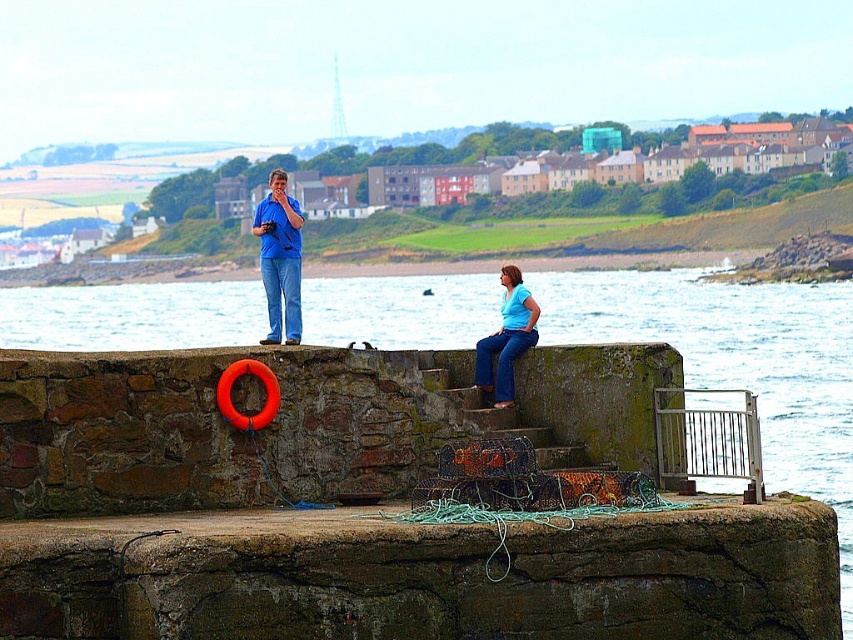
Can you confirm if blue water at center is shorter than blue denim jeans at center?

No.

Between blue water at center and blue denim jeans at center, which one is positioned higher?

blue water at center

This screenshot has width=853, height=640. I want to click on blue water at center, so [x=740, y=364].

Find the location of a particular element. blue water at center is located at coordinates (740, 364).